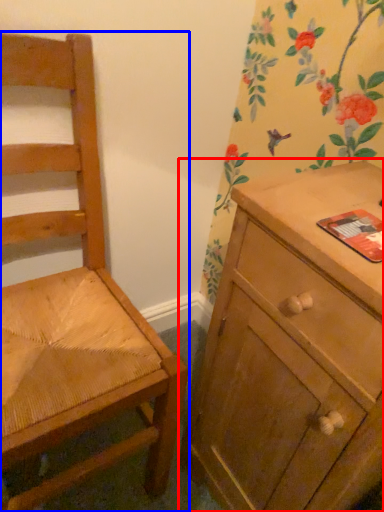
Question: Among these objects, which one is farthest to the camera, chest of drawers (highlighted by a red box) or chair (highlighted by a blue box)?

Choices:
 (A) chest of drawers
 (B) chair

Answer: (A)